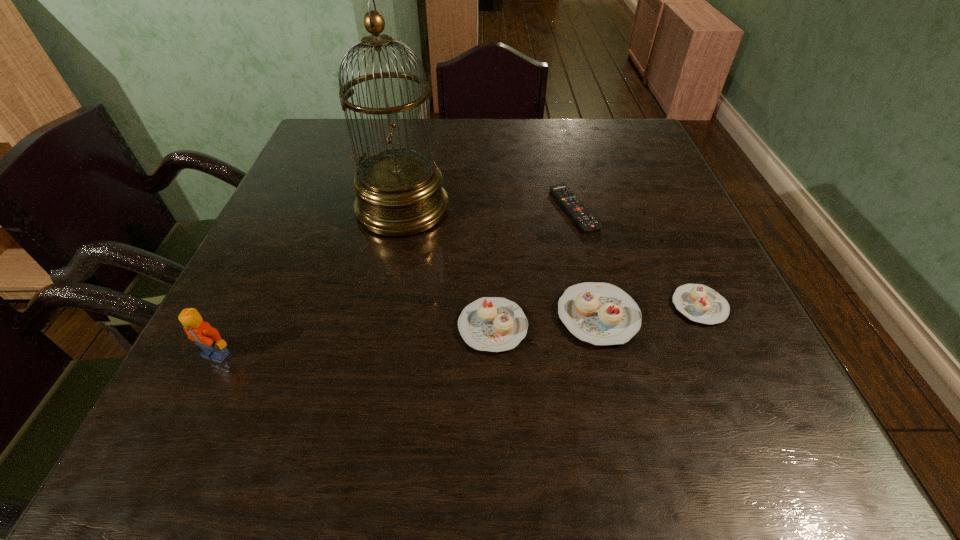
Where is `the second closest cupcake relative to the second cupcake from right to left`? The width and height of the screenshot is (960, 540). the second closest cupcake relative to the second cupcake from right to left is located at coordinates (699, 303).

You are a GUI agent. You are given a task and a screenshot of the screen. Output one action in this format:
    pyautogui.click(x=<x>, y=<y>)
    Task: Click on the free space that satisfies the following two spatial constraints: 1. with an open door on the tallest object; 2. on the front-facing side of the leftmost object
    
    Given the screenshot: What is the action you would take?
    pyautogui.click(x=373, y=354)

I want to click on free space that satisfies the following two spatial constraints: 1. with an open door on the fourth tallest object; 2. on the right side of the birdcage, so click(378, 327).

The width and height of the screenshot is (960, 540). In order to click on vacant space that satisfies the following two spatial constraints: 1. with an open door on the fifth object from right to left; 2. on the back side of the rightmost cupcake in this screenshot , I will do `click(383, 306)`.

Locate an element on the screen. The width and height of the screenshot is (960, 540). vacant region that satisfies the following two spatial constraints: 1. with an open door on the remote control; 2. on the left side of the birdcage is located at coordinates (402, 209).